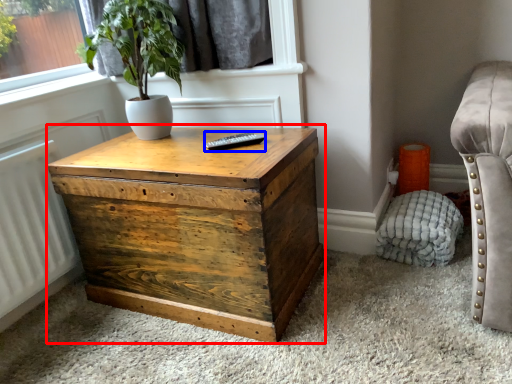
Question: Which object appears farthest to the camera in this image, nightstand (highlighted by a red box) or remote (highlighted by a blue box)?

Choices:
 (A) nightstand
 (B) remote

Answer: (B)